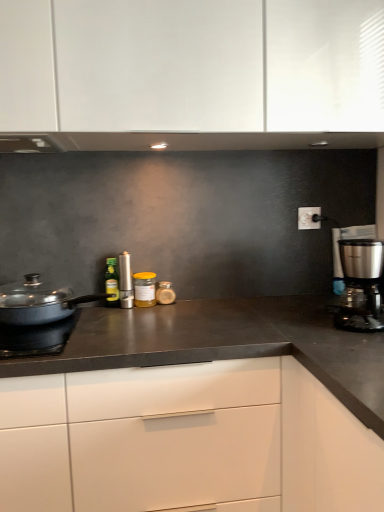
Question: Which direction should I rotate to look at yellow glass jar at center, which is the 3th kitchen appliance in front-to-back order, — up or down?

Choices:
 (A) down
 (B) up

Answer: (A)

Question: Does matte black pan at left have a greater height compared to yellow glass jar at center, the third kitchen appliance from the back?

Choices:
 (A) yes
 (B) no

Answer: (B)

Question: Is matte black pan at left oriented towards yellow glass jar at center, the third kitchen appliance from the back?

Choices:
 (A) no
 (B) yes

Answer: (A)

Question: From the image's perspective, would you say matte black pan at left is shown under yellow glass jar at center, marked as the third kitchen appliance in a right-to-left arrangement?

Choices:
 (A) yes
 (B) no

Answer: (A)

Question: Would you say matte black pan at left is outside yellow glass jar at center, which ranks as the 3th kitchen appliance in left-to-right order?

Choices:
 (A) yes
 (B) no

Answer: (A)

Question: Considering the relative sizes of matte black pan at left and yellow glass jar at center, which ranks as the 3th kitchen appliance in left-to-right order, in the image provided, is matte black pan at left shorter than yellow glass jar at center, which ranks as the 3th kitchen appliance in left-to-right order,?

Choices:
 (A) yes
 (B) no

Answer: (A)

Question: From a real-world perspective, is matte black pan at left under yellow glass jar at center, which is the 3th kitchen appliance in front-to-back order?

Choices:
 (A) no
 (B) yes

Answer: (B)

Question: Is green glass bottle at center, marked as the fourth kitchen appliance in a front-to-back arrangement, thinner than matte black pan at left?

Choices:
 (A) no
 (B) yes

Answer: (B)

Question: From the image's perspective, is green glass bottle at center, which appears as the first kitchen appliance when viewed from the left, below matte black pan at left?

Choices:
 (A) no
 (B) yes

Answer: (A)

Question: Is green glass bottle at center, which appears as the first kitchen appliance when viewed from the left, at the left side of matte black pan at left?

Choices:
 (A) no
 (B) yes

Answer: (A)

Question: Is matte black pan at left at the back of green glass bottle at center, marked as the fourth kitchen appliance in a front-to-back arrangement?

Choices:
 (A) no
 (B) yes

Answer: (B)

Question: Is green glass bottle at center, marked as the fourth kitchen appliance in a front-to-back arrangement, not near matte black pan at left?

Choices:
 (A) yes
 (B) no

Answer: (B)

Question: Are green glass bottle at center, the 5th kitchen appliance in the right-to-left sequence, and matte black pan at left beside each other?

Choices:
 (A) no
 (B) yes

Answer: (A)

Question: Is satin silver canister at center, the fourth kitchen appliance viewed from the right, closer to the viewer compared to white matte cabinet at center?

Choices:
 (A) yes
 (B) no

Answer: (B)